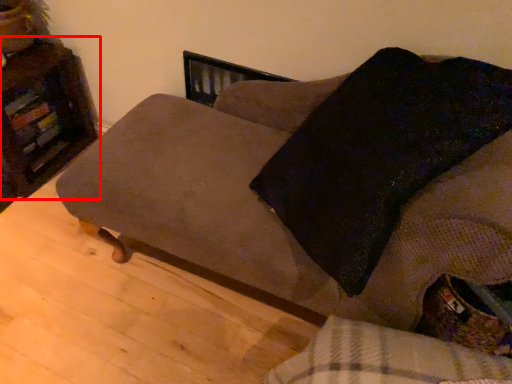
Question: From the image's perspective, where is furniture (annotated by the red box) located in relation to studio couch in the image?

Choices:
 (A) above
 (B) below

Answer: (A)